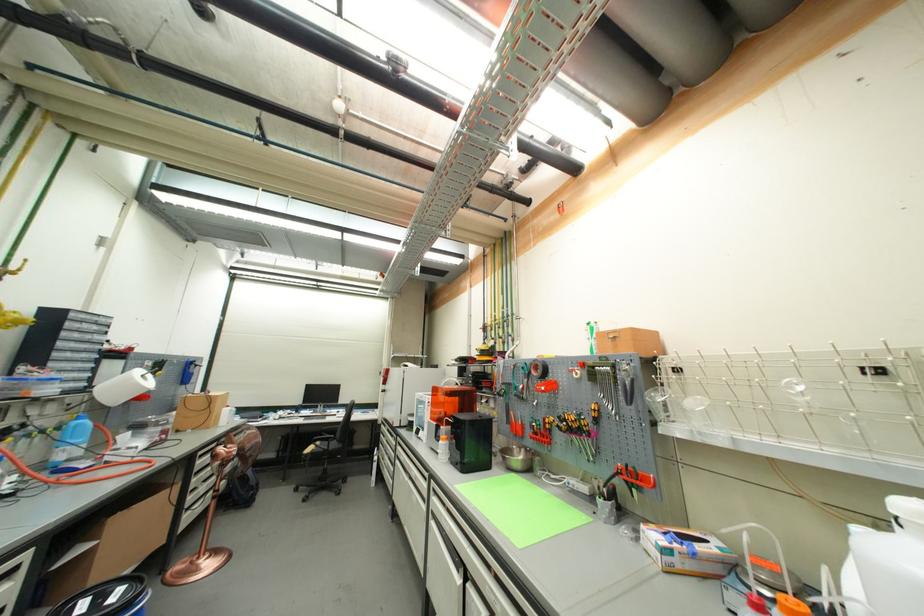
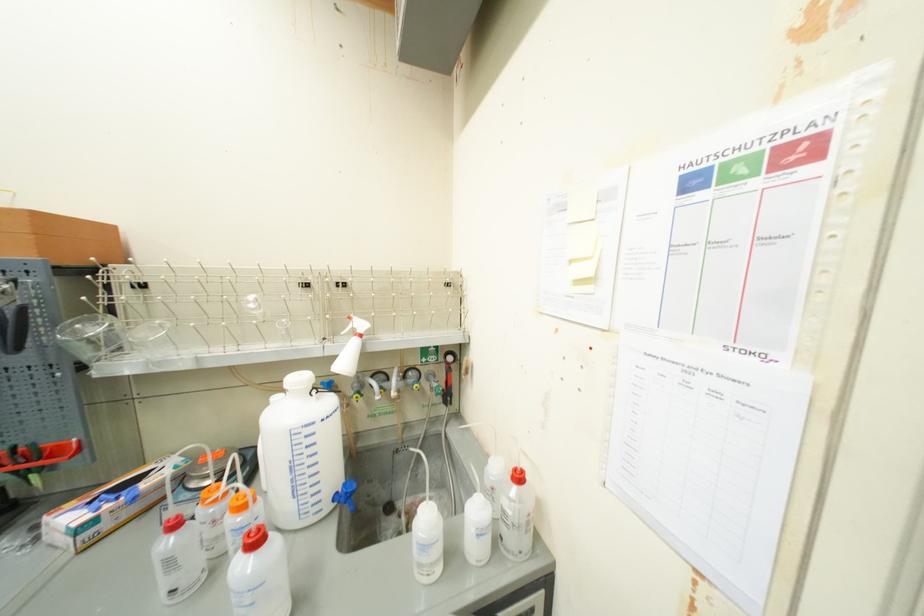
The point at (662, 334) is marked in the first image. Where is the corresponding point in the second image?

(117, 229)